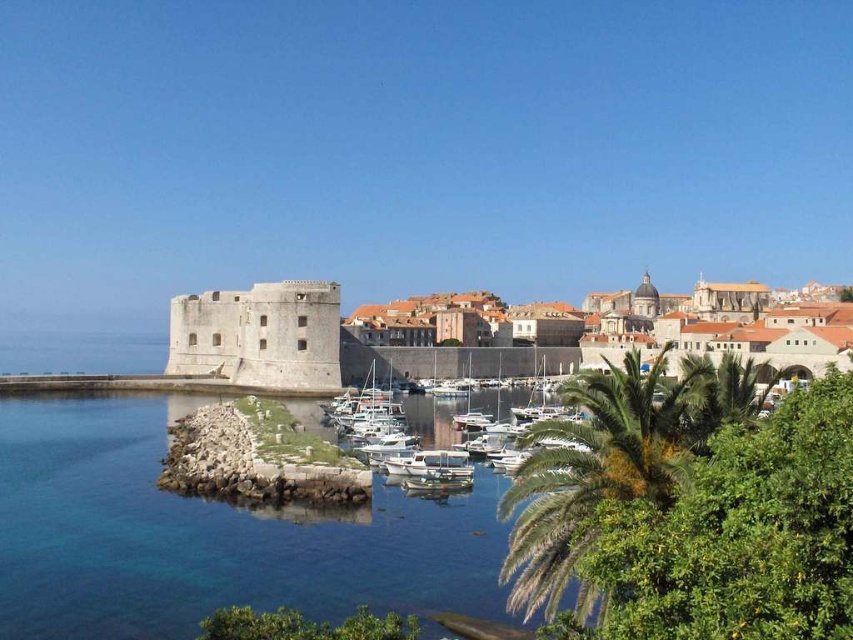
Is green leafy palm tree at lower right bigger than terracotta tiled roofs at center?

Incorrect, green leafy palm tree at lower right is not larger than terracotta tiled roofs at center.

Which is in front, point (640, 435) or point (378, 362)?

Point (640, 435) is more forward.

This screenshot has height=640, width=853. I want to click on green leafy palm tree at lower right, so pyautogui.click(x=614, y=458).

Does green leafy palm tree at lower right have a greater height compared to white glossy boats at center?

Correct, green leafy palm tree at lower right is much taller as white glossy boats at center.

Who is positioned more to the left, green leafy palm tree at lower right or white glossy boats at center?

white glossy boats at center

You are a GUI agent. You are given a task and a screenshot of the screen. Output one action in this format:
    pyautogui.click(x=<x>, y=<y>)
    Task: Click on the green leafy palm tree at lower right
    This screenshot has width=853, height=640.
    Given the screenshot: What is the action you would take?
    pyautogui.click(x=614, y=458)

Is clear blue water at lower left thinner than white glossy boats at center?

In fact, clear blue water at lower left might be wider than white glossy boats at center.

Is clear blue water at lower left below white glossy boats at center?

Indeed, clear blue water at lower left is positioned under white glossy boats at center.

Find the location of a particular element. The height and width of the screenshot is (640, 853). clear blue water at lower left is located at coordinates (207, 534).

Where is `clear blue water at lower left`? The height and width of the screenshot is (640, 853). clear blue water at lower left is located at coordinates (207, 534).